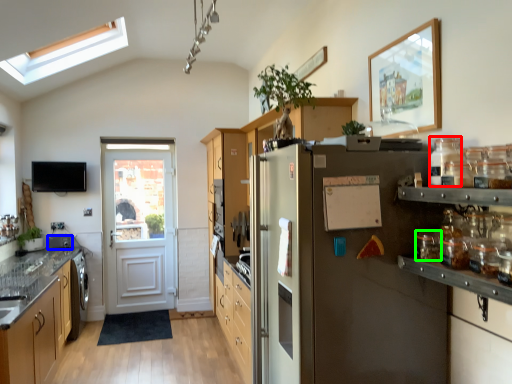
Question: Based on their relative distances, which object is nearer to glass jar (highlighted by a red box)? Choose from appliance (highlighted by a blue box) and glass jar (highlighted by a green box).

Choices:
 (A) appliance
 (B) glass jar

Answer: (B)